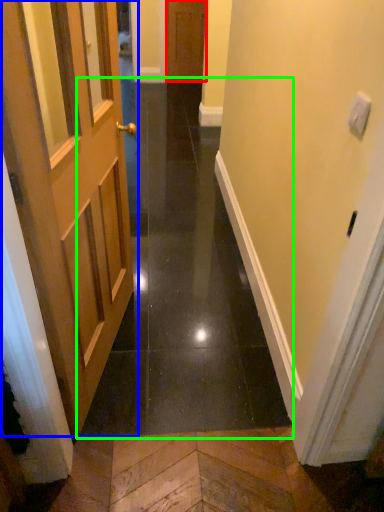
Question: Estimate the real-world distances between objects in this image. Which object is closer to door (highlighted by a red box), door (highlighted by a blue box) or path (highlighted by a green box)?

Choices:
 (A) door
 (B) path

Answer: (B)